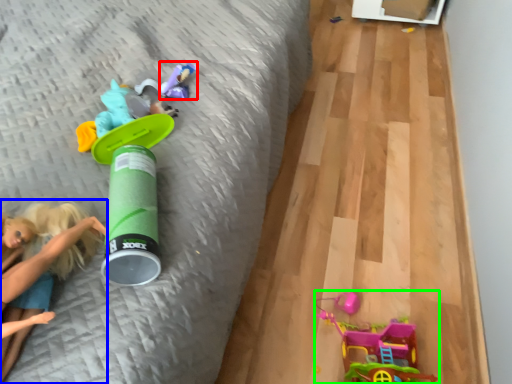
Question: Based on their relative distances, which object is nearer to toy (highlighted by a red box)? Choose from person (highlighted by a blue box) and toy (highlighted by a green box).

Choices:
 (A) person
 (B) toy

Answer: (A)